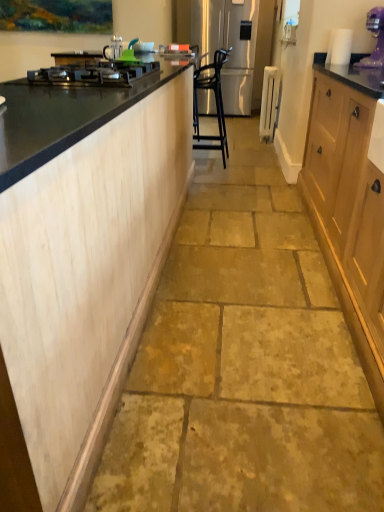
What are the coordinates of `black glass cooktop at left` in the screenshot? It's located at (94, 73).

Identify the location of black glass cooktop at left. (94, 73).

Is black glass cooktop at left wider or thinner than light wood cabinetry at left?

In the image, black glass cooktop at left appears to be more narrow than light wood cabinetry at left.

Which object is more forward, black glass cooktop at left or light wood cabinetry at left?

light wood cabinetry at left is closer to the camera.

Looking at the image, does black glass cooktop at left seem bigger or smaller compared to light wood cabinetry at left?

In the image, black glass cooktop at left appears to be smaller than light wood cabinetry at left.

Is black glass cooktop at left inside the boundaries of light wood cabinetry at left, or outside?

black glass cooktop at left can be found inside light wood cabinetry at left.

Can you tell me how much satin silver refrigerator at center and black glass cooktop at left differ in facing direction?

89.8 degrees separate the facing orientations of satin silver refrigerator at center and black glass cooktop at left.

Is black glass cooktop at left a part of satin silver refrigerator at center?

No, black glass cooktop at left is not surrounded by satin silver refrigerator at center.

Which is in front, point (234, 40) or point (109, 85)?

The point (109, 85) is closer.

Is satin silver refrigerator at center taller or shorter than black glass cooktop at left?

Clearly, satin silver refrigerator at center is taller compared to black glass cooktop at left.

Is satin silver refrigerator at center positioned with its back to light wood cabinetry at left?

satin silver refrigerator at center is not turned away from light wood cabinetry at left.

Is light wood cabinetry at left a part of satin silver refrigerator at center?

No, light wood cabinetry at left is not a part of satin silver refrigerator at center.

In terms of width, does satin silver refrigerator at center look wider or thinner when compared to light wood cabinetry at left?

satin silver refrigerator at center is wider than light wood cabinetry at left.

Does light wood cabinetry at left have a greater height compared to satin silver refrigerator at center?

Incorrect, the height of light wood cabinetry at left is not larger of that of satin silver refrigerator at center.

Is light wood cabinetry at left facing towards satin silver refrigerator at center?

No.

From the image's perspective, which is above, light wood cabinetry at left or satin silver refrigerator at center?

satin silver refrigerator at center.

From a real-world perspective, who is located lower, light wood cabinetry at left or satin silver refrigerator at center?

light wood cabinetry at left.

Are black metal chair at center and satin silver refrigerator at center located far from each other?

Absolutely, black metal chair at center is distant from satin silver refrigerator at center.

Which is less distant, (195,138) or (241,90)?

Positioned in front is point (195,138).

From the picture: Which is behind, black metal chair at center or satin silver refrigerator at center?

Answer: satin silver refrigerator at center.

Which of these two, black metal chair at center or satin silver refrigerator at center, is bigger?

With larger size is satin silver refrigerator at center.

Is black glass cooktop at left oriented away from satin silver refrigerator at center?

No, satin silver refrigerator at center is not at the back of black glass cooktop at left.

Visually, is black glass cooktop at left positioned to the left or to the right of satin silver refrigerator at center?

Based on their positions, black glass cooktop at left is located to the left of satin silver refrigerator at center.

Does black glass cooktop at left have a larger size compared to satin silver refrigerator at center?

Actually, black glass cooktop at left might be smaller than satin silver refrigerator at center.

Based on the photo, can you tell me how much black glass cooktop at left and satin silver refrigerator at center differ in facing direction?

The facing directions of black glass cooktop at left and satin silver refrigerator at center are 89.8 degrees apart.

Does point (232, 54) come in front of point (226, 137)?

That is False.

How far apart are satin silver refrigerator at center and black metal chair at center?

satin silver refrigerator at center is 1.30 meters away from black metal chair at center.

In the scene shown: Does satin silver refrigerator at center contain black metal chair at center?

No, black metal chair at center is not a part of satin silver refrigerator at center.

Is satin silver refrigerator at center turned away from black metal chair at center?

No.

Locate an element on the screen. This screenshot has height=512, width=384. home appliance lying on the left of light wood cabinetry at left is located at coordinates (94, 73).

Image resolution: width=384 pixels, height=512 pixels. I want to click on refrigerator directly beneath the black glass cooktop at left (from a real-world perspective), so click(x=229, y=46).

From the image, which object appears to be farther from black glass cooktop at left, purple plastic blender at upper right or satin silver refrigerator at center?

The object further to black glass cooktop at left is satin silver refrigerator at center.

Looking at this image, which object lies further to the anchor point black glass cooktop at left, light wood cabinetry at left or purple plastic blender at upper right?

purple plastic blender at upper right.

Based on their spatial positions, is light wood cabinetry at left or black glass cooktop at left closer to black metal chair at center?

black glass cooktop at left.

Which object lies further to the anchor point black metal chair at center, light wood cabinetry at left or satin silver refrigerator at center?

light wood cabinetry at left lies further to black metal chair at center than the other object.

Based on their spatial positions, is purple plastic blender at upper right or black metal chair at center further from satin silver refrigerator at center?

Based on the image, purple plastic blender at upper right appears to be further to satin silver refrigerator at center.

When comparing their distances from purple plastic blender at upper right, does light wood cabinetry at left or black glass cooktop at left seem closer?

black glass cooktop at left is positioned closer to the anchor purple plastic blender at upper right.

Which object lies further to the anchor point light wood cabinetry at left, black metal chair at center or purple plastic blender at upper right?

The object further to light wood cabinetry at left is black metal chair at center.

From the image, which object appears to be farther from black glass cooktop at left, satin silver refrigerator at center or purple plastic blender at upper right?

satin silver refrigerator at center is further to black glass cooktop at left.

Find the location of a particular element. kitchen appliance between light wood cabinetry at left and black metal chair at center from front to back is located at coordinates (375, 37).

Locate an element on the screen. The image size is (384, 512). kitchen appliance between black glass cooktop at left and satin silver refrigerator at center from front to back is located at coordinates (375, 37).

Where is `kitchen appliance between light wood cabinetry at left and satin silver refrigerator at center from front to back`? This screenshot has height=512, width=384. kitchen appliance between light wood cabinetry at left and satin silver refrigerator at center from front to back is located at coordinates (375, 37).

Locate an element on the screen. Image resolution: width=384 pixels, height=512 pixels. chair between black glass cooktop at left and satin silver refrigerator at center in the front-back direction is located at coordinates (215, 102).